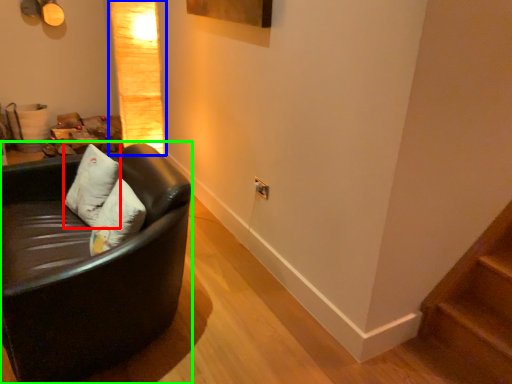
Question: Which is farther away from pillow (highlighted by a red box)? lamp (highlighted by a blue box) or studio couch (highlighted by a green box)?

Choices:
 (A) lamp
 (B) studio couch

Answer: (A)